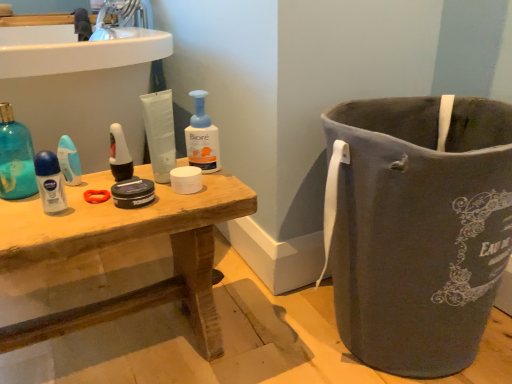
At what (x,y) coordinates should I click in order to perform the action: click on blank space situated above wooden table at center (from a real-world perspective). Please return your answer as a coordinate pair (x, y). Looking at the image, I should click on (114, 183).